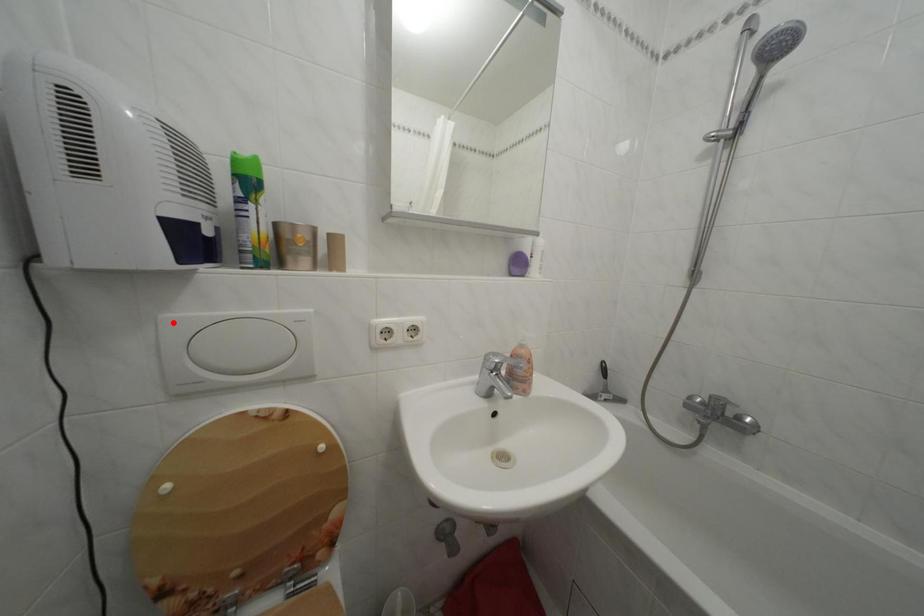
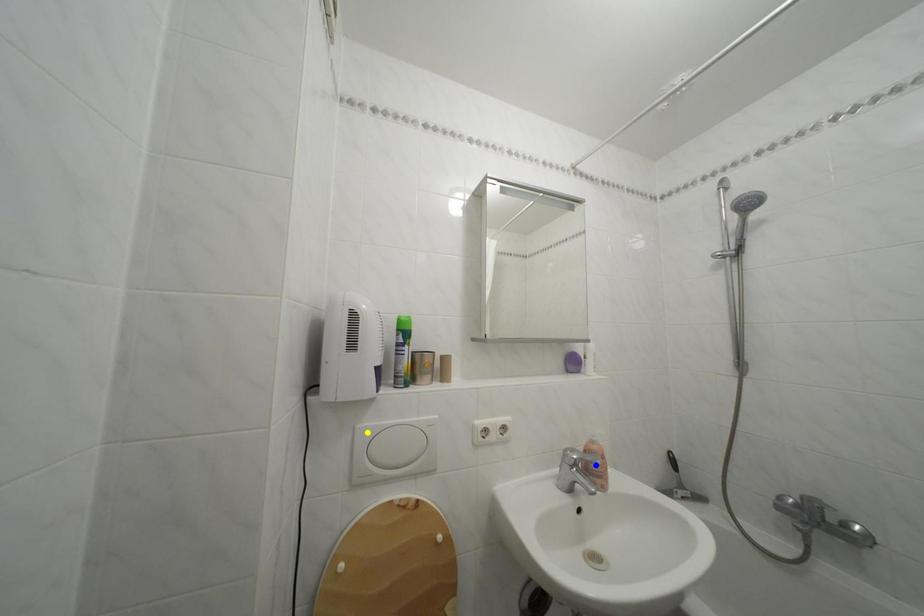
Question: I am providing you with two images of the same scene from different viewpoints. A red point is marked on the first image. You are given multiple points on the second image. Which point in image 2 represents the same 3d spot as the red point in image 1?

Choices:
 (A) green point
 (B) yellow point
 (C) blue point

Answer: (B)